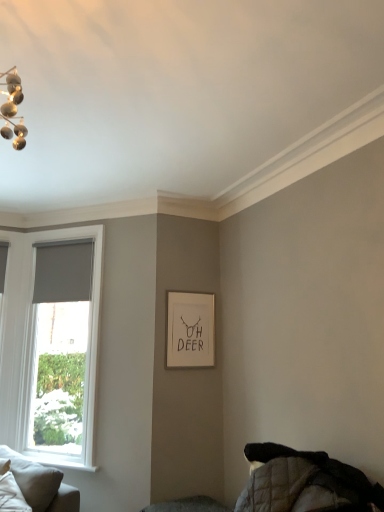
Question: Is light gray fabric couch at lower left positioned with its back to matte gray curtain at left?

Choices:
 (A) yes
 (B) no

Answer: (B)

Question: Can you confirm if light gray fabric couch at lower left is shorter than matte gray curtain at left?

Choices:
 (A) yes
 (B) no

Answer: (A)

Question: Does light gray fabric couch at lower left have a greater height compared to matte gray curtain at left?

Choices:
 (A) yes
 (B) no

Answer: (B)

Question: Is light gray fabric couch at lower left at the left side of matte gray curtain at left?

Choices:
 (A) no
 (B) yes

Answer: (B)

Question: Is light gray fabric couch at lower left aimed at matte gray curtain at left?

Choices:
 (A) yes
 (B) no

Answer: (B)

Question: Is light gray fabric couch at lower left thinner than matte gray curtain at left?

Choices:
 (A) yes
 (B) no

Answer: (B)

Question: From the image's perspective, is white matte picture frame at center below light gray fabric couch at lower left?

Choices:
 (A) no
 (B) yes

Answer: (A)

Question: Does white matte picture frame at center have a lesser width compared to light gray fabric couch at lower left?

Choices:
 (A) no
 (B) yes

Answer: (B)

Question: Considering the relative sizes of white matte picture frame at center and light gray fabric couch at lower left in the image provided, is white matte picture frame at center shorter than light gray fabric couch at lower left?

Choices:
 (A) no
 (B) yes

Answer: (A)

Question: Considering the relative positions of white matte picture frame at center and light gray fabric couch at lower left in the image provided, is white matte picture frame at center behind light gray fabric couch at lower left?

Choices:
 (A) yes
 (B) no

Answer: (A)

Question: From the image's perspective, is white matte picture frame at center over light gray fabric couch at lower left?

Choices:
 (A) yes
 (B) no

Answer: (A)

Question: Is white matte picture frame at center facing towards light gray fabric couch at lower left?

Choices:
 (A) yes
 (B) no

Answer: (B)

Question: Does light gray fabric couch at lower left have a greater height compared to white soft pillow at lower left?

Choices:
 (A) yes
 (B) no

Answer: (A)